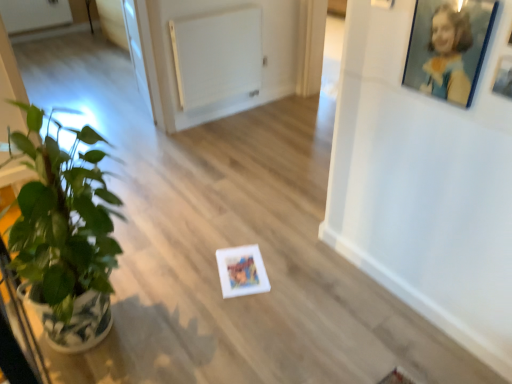
Identify the location of green glossy houseplant at left. (65, 234).

Describe the element at coordinates (137, 52) in the screenshot. I see `transparent glass door at upper left` at that location.

This screenshot has height=384, width=512. Find the location of `transparent glass door at upper left`. transparent glass door at upper left is located at coordinates (137, 52).

What do you see at coordinates (217, 57) in the screenshot? I see `white matte radiator at upper center` at bounding box center [217, 57].

Where is `white matte picture frame at upper right, placed as the first picture frame when sorted from right to left`? The height and width of the screenshot is (384, 512). white matte picture frame at upper right, placed as the first picture frame when sorted from right to left is located at coordinates (503, 77).

Which object is further away from the camera, white matte radiator at upper center or transparent glass door at upper left?

Positioned behind is transparent glass door at upper left.

Considering the relative sizes of white matte radiator at upper center and transparent glass door at upper left in the image provided, is white matte radiator at upper center shorter than transparent glass door at upper left?

Correct, white matte radiator at upper center is not as tall as transparent glass door at upper left.

Can we say white matte radiator at upper center lies outside transparent glass door at upper left?

Absolutely, white matte radiator at upper center is external to transparent glass door at upper left.

Based on the photo, is white matte radiator at upper center positioned before green glossy houseplant at left?

No, it is not.

Which object is thinner, white matte radiator at upper center or green glossy houseplant at left?

white matte radiator at upper center.

From a real-world perspective, between white matte radiator at upper center and green glossy houseplant at left, who is vertically lower?

From a 3D spatial view, white matte radiator at upper center is below.

Is there a large distance between white matte radiator at upper center and green glossy houseplant at left?

Absolutely, white matte radiator at upper center is distant from green glossy houseplant at left.

Considering the relative sizes of white matte picture frame at upper right, placed as the first picture frame when sorted from right to left, and transparent glass door at upper left in the image provided, is white matte picture frame at upper right, placed as the first picture frame when sorted from right to left, thinner than transparent glass door at upper left?

Correct, the width of white matte picture frame at upper right, placed as the first picture frame when sorted from right to left, is less than that of transparent glass door at upper left.

Could transparent glass door at upper left be considered to be inside white matte picture frame at upper right, placed as the first picture frame when sorted from right to left?

Actually, transparent glass door at upper left is outside white matte picture frame at upper right, placed as the first picture frame when sorted from right to left.

Considering the relative positions of white matte picture frame at upper right, which is the second picture frame in left-to-right order, and transparent glass door at upper left in the image provided, is white matte picture frame at upper right, which is the second picture frame in left-to-right order, in front of transparent glass door at upper left?

Yes, white matte picture frame at upper right, which is the second picture frame in left-to-right order, is in front of transparent glass door at upper left.

Considering the sizes of objects white matte picture frame at upper right, which is the second picture frame in left-to-right order, and transparent glass door at upper left in the image provided, who is bigger, white matte picture frame at upper right, which is the second picture frame in left-to-right order, or transparent glass door at upper left?

With larger size is transparent glass door at upper left.

Is green glossy houseplant at left inside transparent glass door at upper left?

Actually, green glossy houseplant at left is outside transparent glass door at upper left.

From the image's perspective, who appears lower, transparent glass door at upper left or green glossy houseplant at left?

From the image's view, green glossy houseplant at left is below.

Is transparent glass door at upper left taller than green glossy houseplant at left?

Incorrect, the height of transparent glass door at upper left is not larger of that of green glossy houseplant at left.

Can you confirm if transparent glass door at upper left is smaller than green glossy houseplant at left?

Yes.

Could you measure the distance between white matte picture frame at upper right, which is the second picture frame in left-to-right order, and blue glossy picture frame at upper right, which is the 1th picture frame from left to right?

white matte picture frame at upper right, which is the second picture frame in left-to-right order, is 6.30 inches from blue glossy picture frame at upper right, which is the 1th picture frame from left to right.

Can you tell me how much white matte picture frame at upper right, which is the second picture frame in left-to-right order, and blue glossy picture frame at upper right, which is the 1th picture frame from left to right, differ in facing direction?

white matte picture frame at upper right, which is the second picture frame in left-to-right order, and blue glossy picture frame at upper right, which is the 1th picture frame from left to right, are facing 0.00291 degrees away from each other.

From a real-world perspective, is white matte picture frame at upper right, placed as the first picture frame when sorted from right to left, physically below blue glossy picture frame at upper right, the second picture frame when ordered from right to left?

Indeed, from a real-world perspective, white matte picture frame at upper right, placed as the first picture frame when sorted from right to left, is positioned beneath blue glossy picture frame at upper right, the second picture frame when ordered from right to left.

From the image's perspective, does white matte picture frame at upper right, which is the second picture frame in left-to-right order, appear higher than blue glossy picture frame at upper right, the second picture frame when ordered from right to left?

No, from the image's perspective, white matte picture frame at upper right, which is the second picture frame in left-to-right order, is not on top of blue glossy picture frame at upper right, the second picture frame when ordered from right to left.

The image size is (512, 384). Identify the location of radiator on the left of white matte picture frame at upper right, which is the second picture frame in left-to-right order. (217, 57).

Looking at this image, is white matte radiator at upper center turned away from white matte picture frame at upper right, which is the second picture frame in left-to-right order?

No.

Which object is closer to the camera, white matte radiator at upper center or white matte picture frame at upper right, placed as the first picture frame when sorted from right to left?

Positioned in front is white matte picture frame at upper right, placed as the first picture frame when sorted from right to left.

In the scene shown: How different are the orientations of white matte radiator at upper center and white matte picture frame at upper right, which is the second picture frame in left-to-right order, in degrees?

88.8 degrees separate the facing orientations of white matte radiator at upper center and white matte picture frame at upper right, which is the second picture frame in left-to-right order.

Measure the distance between transparent glass door at upper left and white matte radiator at upper center.

A distance of 21.41 inches exists between transparent glass door at upper left and white matte radiator at upper center.

Is point (136, 58) closer or farther from the camera than point (220, 24)?

Point (136, 58) is farther from the camera than point (220, 24).

From a real-world perspective, who is located lower, transparent glass door at upper left or white matte radiator at upper center?

From a 3D spatial view, transparent glass door at upper left is below.

Is transparent glass door at upper left facing towards white matte radiator at upper center?

No, transparent glass door at upper left is not oriented towards white matte radiator at upper center.

I want to click on radiator in front of the transparent glass door at upper left, so click(x=217, y=57).

I want to click on radiator below the green glossy houseplant at left (from a real-world perspective), so click(217, 57).

Based on the photo, looking at the image, which one is located closer to transparent glass door at upper left, green glossy houseplant at left or white matte picture frame at upper right, which is the second picture frame in left-to-right order?

Among the two, green glossy houseplant at left is located nearer to transparent glass door at upper left.

Consider the image. From the image, which object appears to be farther from white matte radiator at upper center, green glossy houseplant at left or white matte picture frame at upper right, placed as the first picture frame when sorted from right to left?

white matte picture frame at upper right, placed as the first picture frame when sorted from right to left, is further to white matte radiator at upper center.

Which object lies nearer to the anchor point white matte picture frame at upper right, placed as the first picture frame when sorted from right to left, transparent glass door at upper left or green glossy houseplant at left?

Based on the image, green glossy houseplant at left appears to be nearer to white matte picture frame at upper right, placed as the first picture frame when sorted from right to left.

When comparing their distances from transparent glass door at upper left, does blue glossy picture frame at upper right, the second picture frame when ordered from right to left, or white matte picture frame at upper right, placed as the first picture frame when sorted from right to left, seem further?

white matte picture frame at upper right, placed as the first picture frame when sorted from right to left, is further to transparent glass door at upper left.

From the image, which object appears to be nearer to blue glossy picture frame at upper right, which is the 1th picture frame from left to right, white matte picture frame at upper right, placed as the first picture frame when sorted from right to left, or white matte radiator at upper center?

Among the two, white matte picture frame at upper right, placed as the first picture frame when sorted from right to left, is located nearer to blue glossy picture frame at upper right, which is the 1th picture frame from left to right.

Looking at the image, which one is located further to white matte radiator at upper center, white matte picture frame at upper right, which is the second picture frame in left-to-right order, or blue glossy picture frame at upper right, which is the 1th picture frame from left to right?

white matte picture frame at upper right, which is the second picture frame in left-to-right order.

Looking at the image, which one is located closer to white matte picture frame at upper right, placed as the first picture frame when sorted from right to left, white matte radiator at upper center or transparent glass door at upper left?

white matte radiator at upper center is positioned closer to the anchor white matte picture frame at upper right, placed as the first picture frame when sorted from right to left.

Which object lies further to the anchor point blue glossy picture frame at upper right, which is the 1th picture frame from left to right, white matte picture frame at upper right, placed as the first picture frame when sorted from right to left, or green glossy houseplant at left?

Among the two, green glossy houseplant at left is located further to blue glossy picture frame at upper right, which is the 1th picture frame from left to right.

Locate an element on the screen. radiator located between green glossy houseplant at left and transparent glass door at upper left in the depth direction is located at coordinates (217, 57).

Find the location of a particular element. The height and width of the screenshot is (384, 512). radiator between blue glossy picture frame at upper right, the second picture frame when ordered from right to left, and transparent glass door at upper left in the front-back direction is located at coordinates (217, 57).

Where is `picture frame between white matte picture frame at upper right, placed as the first picture frame when sorted from right to left, and transparent glass door at upper left from front to back`? picture frame between white matte picture frame at upper right, placed as the first picture frame when sorted from right to left, and transparent glass door at upper left from front to back is located at coordinates (448, 47).

At what (x,y) coordinates should I click in order to perform the action: click on radiator located between white matte picture frame at upper right, placed as the first picture frame when sorted from right to left, and transparent glass door at upper left in the depth direction. Please return your answer as a coordinate pair (x, y). This screenshot has width=512, height=384. Looking at the image, I should click on [217, 57].